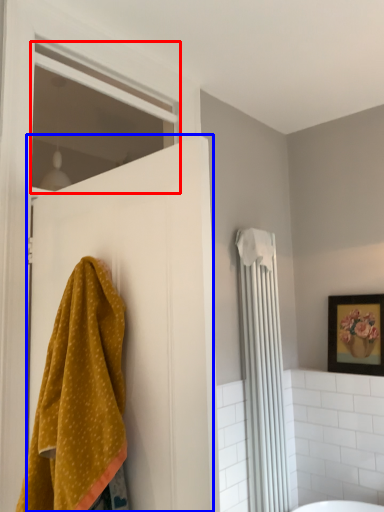
Question: Among these objects, which one is nearest to the camera, window (highlighted by a red box) or door (highlighted by a blue box)?

Choices:
 (A) window
 (B) door

Answer: (B)